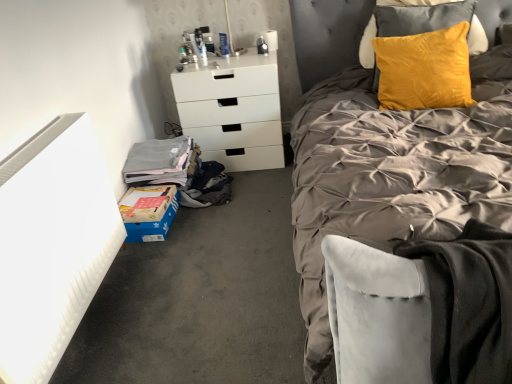
Question: In terms of size, does white matte chest of drawers at center appear bigger or smaller than blue cardboard box at lower left?

Choices:
 (A) small
 (B) big

Answer: (B)

Question: From a real-world perspective, is white matte chest of drawers at center physically located above or below blue cardboard box at lower left?

Choices:
 (A) below
 (B) above

Answer: (B)

Question: Which object is the closest to the white matte chest of drawers at center?

Choices:
 (A) blue cardboard box at lower left
 (B) yellow velvet pillow at upper right
 (C) blue cardboard box at lower left
 (D) silky gray duvet at center

Answer: (B)

Question: Based on their relative distances, which object is nearer to the blue cardboard box at lower left?

Choices:
 (A) white matte chest of drawers at center
 (B) silky gray duvet at center
 (C) blue cardboard box at lower left
 (D) yellow velvet pillow at upper right

Answer: (C)